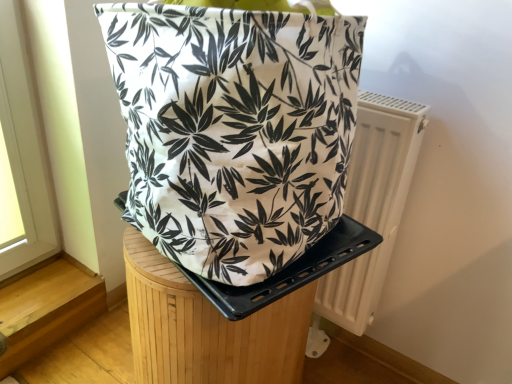
Question: Does white plastic radiator at right have a greater width compared to wooden stool at center?

Choices:
 (A) yes
 (B) no

Answer: (B)

Question: Is white plastic radiator at right at the left side of wooden stool at center?

Choices:
 (A) yes
 (B) no

Answer: (B)

Question: Is white plastic radiator at right bigger than wooden stool at center?

Choices:
 (A) yes
 (B) no

Answer: (B)

Question: Is white plastic radiator at right closer to the viewer compared to wooden stool at center?

Choices:
 (A) no
 (B) yes

Answer: (A)

Question: Is white plastic radiator at right thinner than wooden stool at center?

Choices:
 (A) no
 (B) yes

Answer: (B)

Question: Is white plastic radiator at right directly adjacent to wooden stool at center?

Choices:
 (A) yes
 (B) no

Answer: (B)

Question: Can you confirm if white plastic radiator at right is shorter than white canvas bag at center?

Choices:
 (A) no
 (B) yes

Answer: (A)

Question: Is white plastic radiator at right turned away from white canvas bag at center?

Choices:
 (A) yes
 (B) no

Answer: (B)

Question: Is white plastic radiator at right positioned behind white canvas bag at center?

Choices:
 (A) yes
 (B) no

Answer: (A)

Question: Does white plastic radiator at right touch white canvas bag at center?

Choices:
 (A) yes
 (B) no

Answer: (B)

Question: Does white plastic radiator at right have a greater width compared to white canvas bag at center?

Choices:
 (A) no
 (B) yes

Answer: (A)

Question: Is white plastic radiator at right bigger than white canvas bag at center?

Choices:
 (A) yes
 (B) no

Answer: (B)

Question: Is wooden stool at center far from white plastic radiator at right?

Choices:
 (A) no
 (B) yes

Answer: (A)